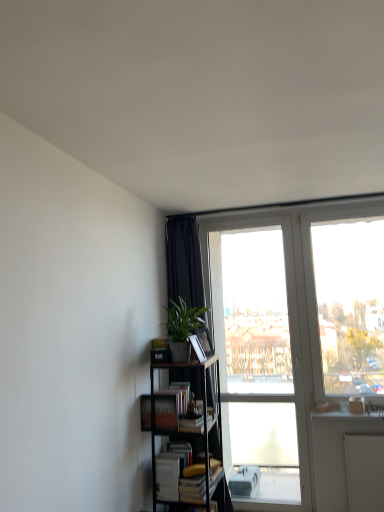
Question: Would you say white matte book at lower center, the first book when ordered from bottom to top, is part of hardcover book at center, placed as the 1th paperback book when sorted from bottom to top,'s contents?

Choices:
 (A) yes
 (B) no

Answer: (B)

Question: Is hardcover book at center, placed as the 1th paperback book when sorted from bottom to top, to the left of white matte book at lower center, marked as the 2th book in a top-to-bottom arrangement, from the viewer's perspective?

Choices:
 (A) yes
 (B) no

Answer: (B)

Question: From the image's perspective, would you say hardcover book at center, placed as the 1th paperback book when sorted from bottom to top, is shown under white matte book at lower center, the first book when ordered from bottom to top?

Choices:
 (A) yes
 (B) no

Answer: (B)

Question: Is hardcover book at center, the 2th paperback book from the top, in front of white matte book at lower center, marked as the 2th book in a top-to-bottom arrangement?

Choices:
 (A) yes
 (B) no

Answer: (B)

Question: Are hardcover book at center, the 2th paperback book from the top, and white matte book at lower center, the first book when ordered from bottom to top, making contact?

Choices:
 (A) no
 (B) yes

Answer: (A)

Question: Do you think transparent glass door at upper right is within matte black paperback book at center, marked as the first paperback book in a top-to-bottom arrangement, or outside of it?

Choices:
 (A) inside
 (B) outside

Answer: (B)

Question: In terms of width, does transparent glass door at upper right look wider or thinner when compared to matte black paperback book at center, the 2th paperback book from the bottom?

Choices:
 (A) thin
 (B) wide

Answer: (B)

Question: Considering the positions of transparent glass door at upper right and matte black paperback book at center, marked as the first paperback book in a top-to-bottom arrangement, in the image, is transparent glass door at upper right bigger or smaller than matte black paperback book at center, marked as the first paperback book in a top-to-bottom arrangement,?

Choices:
 (A) big
 (B) small

Answer: (A)

Question: Does point (375, 506) appear closer or farther from the camera than point (198, 337)?

Choices:
 (A) farther
 (B) closer

Answer: (B)

Question: Considering the positions of point (198, 410) and point (317, 242), is point (198, 410) closer or farther from the camera than point (317, 242)?

Choices:
 (A) farther
 (B) closer

Answer: (B)

Question: In the image, is hardcover book at center, placed as the 1th paperback book when sorted from bottom to top, positioned in front of or behind transparent glass door at upper right?

Choices:
 (A) behind
 (B) front

Answer: (B)

Question: Looking at the image, does hardcover book at center, the 2th paperback book from the top, seem bigger or smaller compared to transparent glass door at upper right?

Choices:
 (A) big
 (B) small

Answer: (B)

Question: Would you say hardcover book at center, the 2th paperback book from the top, is inside or outside transparent glass door at upper right?

Choices:
 (A) outside
 (B) inside

Answer: (A)

Question: Does point (380, 408) appear closer or farther from the camera than point (218, 488)?

Choices:
 (A) closer
 (B) farther

Answer: (A)

Question: From the image's perspective, is transparent glass door at upper right located above or below black metal bookcase at lower left?

Choices:
 (A) above
 (B) below

Answer: (A)